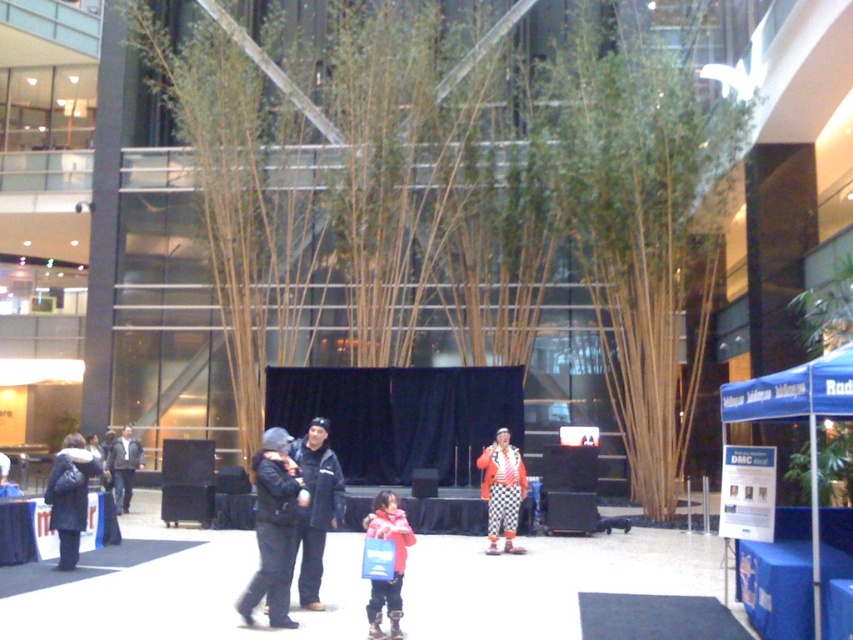
Question: Among these points, which one is farthest from the camera?

Choices:
 (A) (369, 524)
 (B) (115, 502)

Answer: (B)

Question: Can you confirm if black fuzzy jacket at center is wider than dark gray wool jacket at center?

Choices:
 (A) no
 (B) yes

Answer: (B)

Question: Which of the following is the closest to the observer?

Choices:
 (A) matte black coat at left
 (B) dark gray wool jacket at center
 (C) fluffy pink coat at center

Answer: (C)

Question: Which of the following is the farthest from the observer?

Choices:
 (A) (514, 538)
 (B) (264, 612)

Answer: (A)

Question: Does brown wood tree at center come behind matte black coat at left?

Choices:
 (A) no
 (B) yes

Answer: (B)

Question: Is dark gray wool jacket at center in front of orange and white checkered clown costume at center?

Choices:
 (A) yes
 (B) no

Answer: (A)